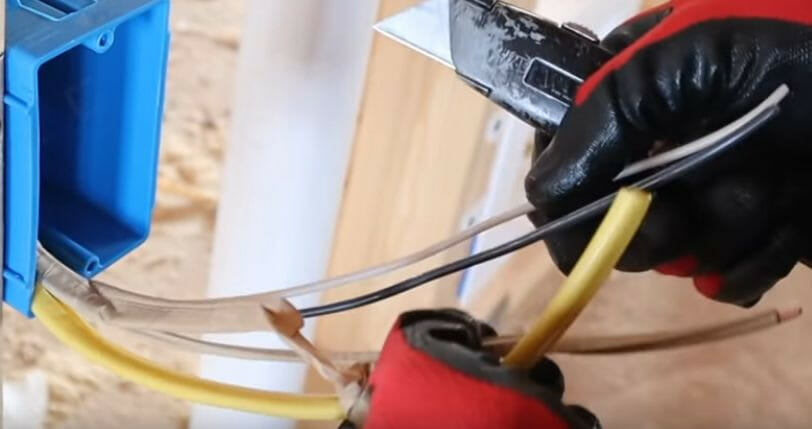
Where is `white cable`? Image resolution: width=812 pixels, height=429 pixels. white cable is located at coordinates (421, 257), (666, 347).